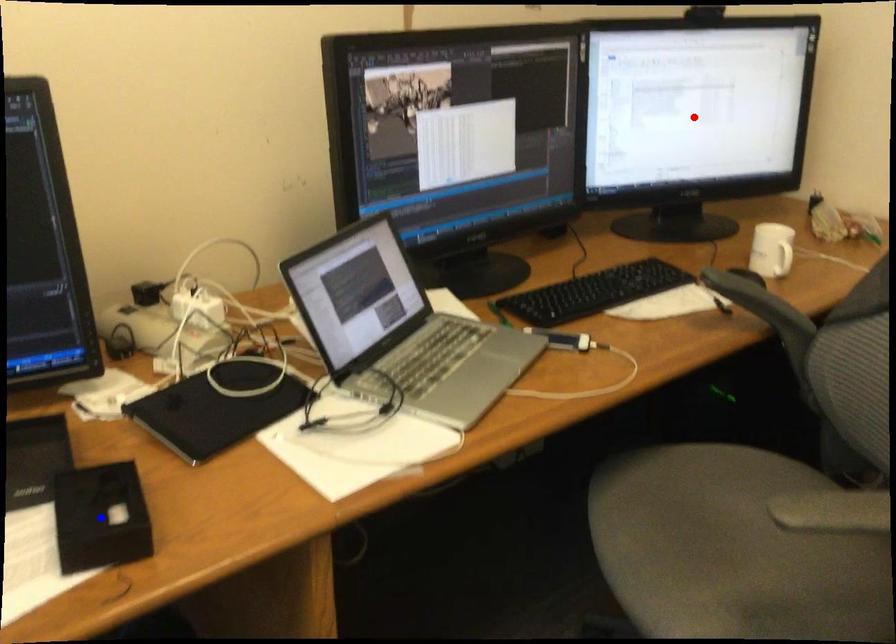
Question: In the image, two points are highlighted. Which point is nearer to the camera? Reply with the corresponding letter.

Choices:
 (A) blue point
 (B) red point

Answer: (A)